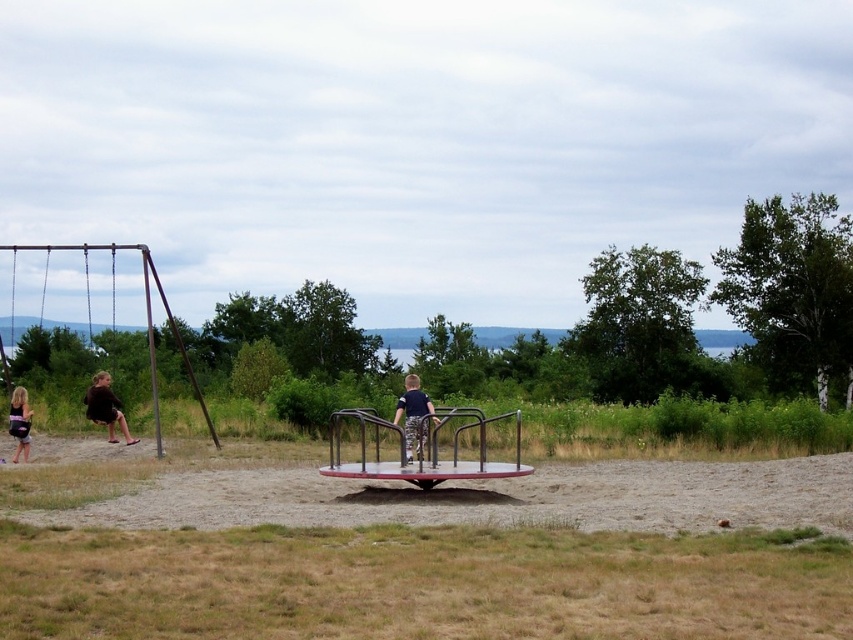
You are a parent observing children at the playground. You see a child wearing dark brown fabric pants at left and another wearing camouflage pants at center. Which child is closer to you?

The dark brown fabric pants at left are closer to you than the camouflage pants at center because the dark brown fabric pants at left is further to the viewer than camouflage pants at center.

From the picture: You are a parent trying to decide where to let your child play. The scene has brown sandy dirt at center and smooth sand at center. Which area would be better for a sandbox activity?

The smooth sand at center is better for a sandbox activity because the brown sandy dirt at center is positioned over it, indicating the smooth sand is the designated play area.

You are a parent looking at the playground. You see two children wearing camouflage pants at center and matte black shorts at lower left. Which child is shorter?

The camouflage pants at center is not as tall as matte black shorts at lower left, so the child wearing camouflage pants at center is shorter.